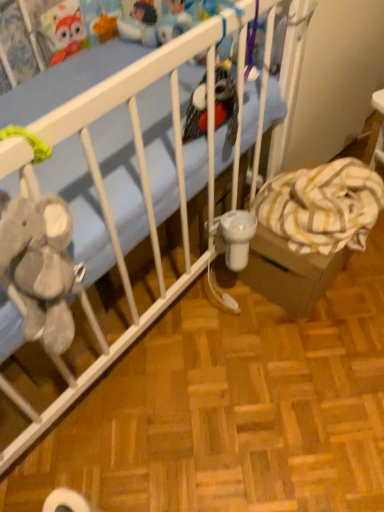
What is the approximate width of matte plastic toy at upper center, which is counted as the first toy, starting from the left?

matte plastic toy at upper center, which is counted as the first toy, starting from the left, is 3.10 inches wide.

You are a GUI agent. You are given a task and a screenshot of the screen. Output one action in this format:
    pyautogui.click(x=<x>, y=<y>)
    Task: Click on the velvety plush bird at center, which ranks as the 2th toy in back-to-front order
    
    Given the screenshot: What is the action you would take?
    pyautogui.click(x=226, y=102)

Is yellow striped blanket at lower right positioned with its back to striped fabric cardboard box at lower right?

yellow striped blanket at lower right does not have its back to striped fabric cardboard box at lower right.

What's the angular difference between yellow striped blanket at lower right and striped fabric cardboard box at lower right's facing directions?

The angle between the facing direction of yellow striped blanket at lower right and the facing direction of striped fabric cardboard box at lower right is 2.41 degrees.

Between yellow striped blanket at lower right and striped fabric cardboard box at lower right, which one has less height?

yellow striped blanket at lower right.

Is point (313, 197) positioned behind point (295, 271)?

That is True.

Is blue fabric crib at upper left next to yellow striped blanket at lower right?

There is a gap between blue fabric crib at upper left and yellow striped blanket at lower right.

Is point (52, 423) farther from camera compared to point (337, 227)?

That is False.

Considering the sizes of objects blue fabric crib at upper left and yellow striped blanket at lower right in the image provided, who is bigger, blue fabric crib at upper left or yellow striped blanket at lower right?

Result: Bigger between the two is blue fabric crib at upper left.

From the image's perspective, between blue fabric crib at upper left and yellow striped blanket at lower right, who is located below?

From the image's view, blue fabric crib at upper left is below.

Considering their positions, is blue fabric crib at upper left located in front of or behind striped fabric cardboard box at lower right?

In the image, blue fabric crib at upper left appears in front of striped fabric cardboard box at lower right.

From a real-world perspective, who is located higher, blue fabric crib at upper left or striped fabric cardboard box at lower right?

From a 3D spatial view, striped fabric cardboard box at lower right is above.

Which object is wider, blue fabric crib at upper left or striped fabric cardboard box at lower right?

blue fabric crib at upper left.

Is blue fabric crib at upper left taller than striped fabric cardboard box at lower right?

In fact, blue fabric crib at upper left may be shorter than striped fabric cardboard box at lower right.

Is striped fabric cardboard box at lower right aimed at velvety plush bird at center, the 1th toy in the right-to-left sequence?

No.

From the image's perspective, is striped fabric cardboard box at lower right below velvety plush bird at center, acting as the 1th toy starting from the front?

Correct, striped fabric cardboard box at lower right appears lower than velvety plush bird at center, acting as the 1th toy starting from the front, in the image.

Which is in front, striped fabric cardboard box at lower right or velvety plush bird at center, which ranks as the 2th toy in back-to-front order?

Positioned in front is velvety plush bird at center, which ranks as the 2th toy in back-to-front order.

Consider the image. Considering the relative positions of striped fabric cardboard box at lower right and velvety plush bird at center, the 1th toy in the right-to-left sequence, in the image provided, is striped fabric cardboard box at lower right to the left of velvety plush bird at center, the 1th toy in the right-to-left sequence, from the viewer's perspective?

No, striped fabric cardboard box at lower right is not to the left of velvety plush bird at center, the 1th toy in the right-to-left sequence.

Based on the photo, is matte plastic toy at upper center, arranged as the first toy when viewed from the back, bigger or smaller than striped fabric cardboard box at lower right?

matte plastic toy at upper center, arranged as the first toy when viewed from the back, is smaller than striped fabric cardboard box at lower right.

Is matte plastic toy at upper center, the second toy positioned from the front, facing towards striped fabric cardboard box at lower right?

No, matte plastic toy at upper center, the second toy positioned from the front, is not aimed at striped fabric cardboard box at lower right.

Does matte plastic toy at upper center, which appears as the 1th toy when viewed from the top, lie behind striped fabric cardboard box at lower right?

Yes, it is behind striped fabric cardboard box at lower right.

Is point (151, 5) closer to viewer compared to point (233, 179)?

Yes, point (151, 5) is in front of point (233, 179).

Is blue fabric crib at upper left surrounded by matte plastic toy at upper center, the second toy positioned from the front?

No, blue fabric crib at upper left is not inside matte plastic toy at upper center, the second toy positioned from the front.

From a real-world perspective, is matte plastic toy at upper center, the second toy positioned from the front, physically below blue fabric crib at upper left?

Incorrect, from a real-world perspective, matte plastic toy at upper center, the second toy positioned from the front, is higher than blue fabric crib at upper left.

Considering the sizes of objects matte plastic toy at upper center, acting as the second toy starting from the right, and blue fabric crib at upper left in the image provided, who is shorter, matte plastic toy at upper center, acting as the second toy starting from the right, or blue fabric crib at upper left?

With less height is blue fabric crib at upper left.

Considering the sizes of objects matte plastic toy at upper center, the second toy positioned from the front, and yellow striped blanket at lower right in the image provided, who is wider, matte plastic toy at upper center, the second toy positioned from the front, or yellow striped blanket at lower right?

Wider between the two is yellow striped blanket at lower right.

In terms of height, does matte plastic toy at upper center, which appears as the 1th toy when viewed from the top, look taller or shorter compared to yellow striped blanket at lower right?

matte plastic toy at upper center, which appears as the 1th toy when viewed from the top, is shorter than yellow striped blanket at lower right.

From the picture: From the image's perspective, is matte plastic toy at upper center, arranged as the first toy when viewed from the back, on top of yellow striped blanket at lower right?

Yes.

The width and height of the screenshot is (384, 512). In order to click on blanket on the right of the striped fabric cardboard box at lower right in this screenshot , I will do `click(322, 206)`.

This screenshot has width=384, height=512. I want to click on infant bed located below the yellow striped blanket at lower right (from the image's perspective), so click(x=142, y=194).

Considering their positions, is yellow striped blanket at lower right positioned closer to matte plastic toy at upper center, which appears as the 1th toy when viewed from the top, than velvety plush bird at center, acting as the 1th toy starting from the front?

Among the two, velvety plush bird at center, acting as the 1th toy starting from the front, is located nearer to matte plastic toy at upper center, which appears as the 1th toy when viewed from the top.

Which object lies nearer to the anchor point matte plastic toy at upper center, which is counted as the first toy, starting from the left, yellow striped blanket at lower right or blue fabric crib at upper left?

Based on the image, blue fabric crib at upper left appears to be nearer to matte plastic toy at upper center, which is counted as the first toy, starting from the left.

From the image, which object appears to be farther from yellow striped blanket at lower right, blue fabric crib at upper left or matte plastic toy at upper center, which is counted as the first toy, starting from the left?

matte plastic toy at upper center, which is counted as the first toy, starting from the left, lies further to yellow striped blanket at lower right than the other object.

Estimate the real-world distances between objects in this image. Which object is closer to matte plastic toy at upper center, arranged as the first toy when viewed from the back, striped fabric cardboard box at lower right or velvety plush bird at center, which ranks as the 2th toy in back-to-front order?

velvety plush bird at center, which ranks as the 2th toy in back-to-front order.

Which object lies further to the anchor point velvety plush bird at center, the 2th toy viewed from the top, matte plastic toy at upper center, which is counted as the first toy, starting from the left, or striped fabric cardboard box at lower right?

Among the two, matte plastic toy at upper center, which is counted as the first toy, starting from the left, is located further to velvety plush bird at center, the 2th toy viewed from the top.

Looking at the image, which one is located further to blue fabric crib at upper left, matte plastic toy at upper center, acting as the second toy starting from the right, or velvety plush bird at center, the 2th toy viewed from the top?

Based on the image, matte plastic toy at upper center, acting as the second toy starting from the right, appears to be further to blue fabric crib at upper left.

Looking at the image, which one is located closer to yellow striped blanket at lower right, blue fabric crib at upper left or striped fabric cardboard box at lower right?

striped fabric cardboard box at lower right is positioned closer to the anchor yellow striped blanket at lower right.

Considering their positions, is striped fabric cardboard box at lower right positioned further to velvety plush bird at center, which ranks as the 2th toy in back-to-front order, than matte plastic toy at upper center, arranged as the first toy when viewed from the back?

Based on the image, matte plastic toy at upper center, arranged as the first toy when viewed from the back, appears to be further to velvety plush bird at center, which ranks as the 2th toy in back-to-front order.

Where is `toy between matte plastic toy at upper center, which appears as the 1th toy when viewed from the top, and striped fabric cardboard box at lower right from top to bottom`? toy between matte plastic toy at upper center, which appears as the 1th toy when viewed from the top, and striped fabric cardboard box at lower right from top to bottom is located at coordinates (226, 102).

Find the location of `cardboard box that lies between matte plastic toy at upper center, which is the second toy in bottom-to-top order, and blue fabric crib at upper left from top to bottom`. cardboard box that lies between matte plastic toy at upper center, which is the second toy in bottom-to-top order, and blue fabric crib at upper left from top to bottom is located at coordinates (289, 272).

What are the coordinates of `blanket positioned between velvety plush bird at center, acting as the 1th toy starting from the front, and striped fabric cardboard box at lower right from near to far` in the screenshot? It's located at (322, 206).

Find the location of a particular element. blanket between velvety plush bird at center, the 1th toy in the right-to-left sequence, and blue fabric crib at upper left, in the vertical direction is located at coordinates click(322, 206).